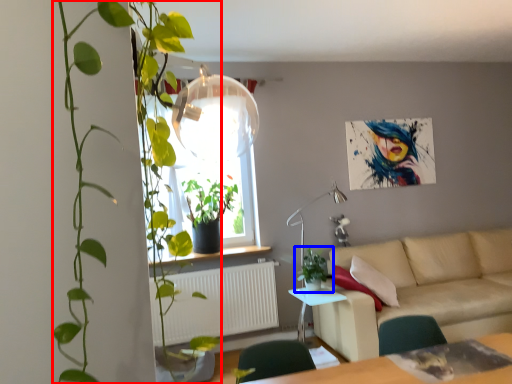
Question: Which object is further to the camera taking this photo, houseplant (highlighted by a red box) or houseplant (highlighted by a blue box)?

Choices:
 (A) houseplant
 (B) houseplant

Answer: (B)